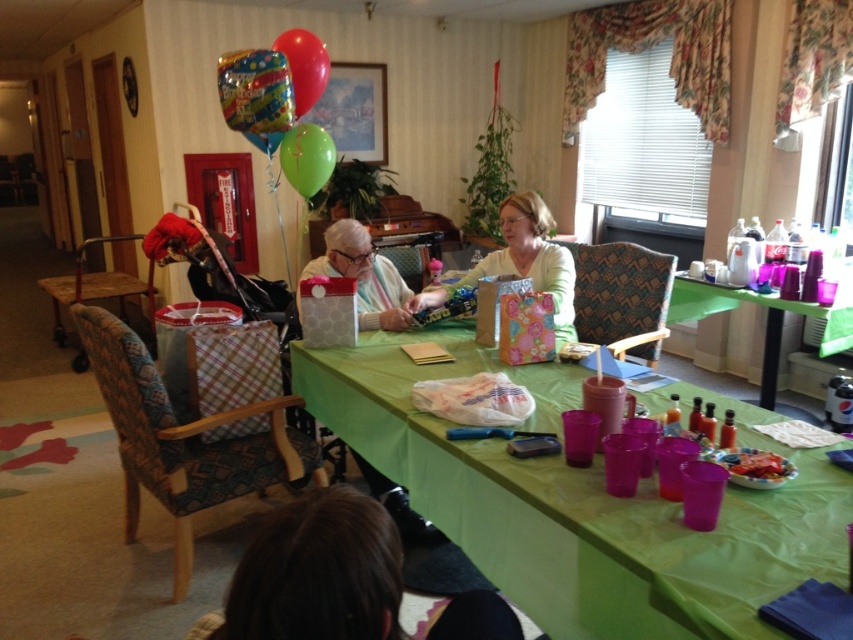
Between translucent plastic cups at right and green rubber balloon at upper center, which one has more height?

With more height is translucent plastic cups at right.

Looking at this image, measure the distance between point (839, 312) and camera.

A distance of 3.06 meters exists between point (839, 312) and camera.

Find the location of a particular element. Image resolution: width=853 pixels, height=640 pixels. translucent plastic cups at right is located at coordinates (764, 321).

Where is `translucent plastic cups at right`? The width and height of the screenshot is (853, 640). translucent plastic cups at right is located at coordinates (764, 321).

Does point (437, 436) come closer to viewer compared to point (408, 508)?

Yes, point (437, 436) is in front of point (408, 508).

Between green fabric table at center and white paper bag at center, which one appears on the left side from the viewer's perspective?

white paper bag at center is more to the left.

Is point (683, 595) farther from camera compared to point (299, 292)?

No, it is in front of (299, 292).

Locate an element on the screen. The height and width of the screenshot is (640, 853). green fabric table at center is located at coordinates (579, 502).

Is matte white shirt at center further to camera compared to green rubber balloon at upper center?

No, it is in front of green rubber balloon at upper center.

Is matte white shirt at center shorter than green rubber balloon at upper center?

Incorrect, matte white shirt at center's height does not fall short of green rubber balloon at upper center's.

Where is `matte white shirt at center`? The image size is (853, 640). matte white shirt at center is located at coordinates (521, 262).